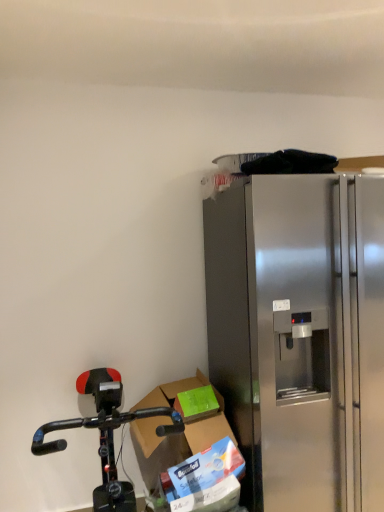
Question: Does black matte bicycle at lower left have a smaller size compared to stainless steel refrigerator at right?

Choices:
 (A) no
 (B) yes

Answer: (B)

Question: Considering the relative sizes of black matte bicycle at lower left and stainless steel refrigerator at right in the image provided, is black matte bicycle at lower left wider than stainless steel refrigerator at right?

Choices:
 (A) no
 (B) yes

Answer: (B)

Question: Considering the relative positions of black matte bicycle at lower left and stainless steel refrigerator at right in the image provided, is black matte bicycle at lower left to the left of stainless steel refrigerator at right from the viewer's perspective?

Choices:
 (A) yes
 (B) no

Answer: (A)

Question: Can stainless steel refrigerator at right be found inside black matte bicycle at lower left?

Choices:
 (A) no
 (B) yes

Answer: (A)

Question: From the image's perspective, is black matte bicycle at lower left located beneath stainless steel refrigerator at right?

Choices:
 (A) no
 (B) yes

Answer: (B)

Question: In terms of height, does black matte bicycle at lower left look taller or shorter compared to cardboard box at lower center?

Choices:
 (A) tall
 (B) short

Answer: (A)

Question: Considering the positions of black matte bicycle at lower left and cardboard box at lower center in the image, is black matte bicycle at lower left bigger or smaller than cardboard box at lower center?

Choices:
 (A) small
 (B) big

Answer: (B)

Question: Considering their positions, is black matte bicycle at lower left located in front of or behind cardboard box at lower center?

Choices:
 (A) front
 (B) behind

Answer: (A)

Question: Considering the positions of point (139, 411) and point (205, 381), is point (139, 411) closer or farther from the camera than point (205, 381)?

Choices:
 (A) farther
 (B) closer

Answer: (A)

Question: From the image's perspective, is cardboard box at lower center located above or below stainless steel refrigerator at right?

Choices:
 (A) above
 (B) below

Answer: (B)

Question: In terms of height, does cardboard box at lower center look taller or shorter compared to stainless steel refrigerator at right?

Choices:
 (A) short
 (B) tall

Answer: (A)

Question: From a real-world perspective, relative to stainless steel refrigerator at right, is cardboard box at lower center vertically above or below?

Choices:
 (A) below
 (B) above

Answer: (A)

Question: Is cardboard box at lower center to the left or to the right of stainless steel refrigerator at right in the image?

Choices:
 (A) right
 (B) left

Answer: (B)

Question: Do you think stainless steel refrigerator at right is within black matte bicycle at lower left, or outside of it?

Choices:
 (A) inside
 (B) outside

Answer: (B)

Question: In the image, is stainless steel refrigerator at right positioned in front of or behind black matte bicycle at lower left?

Choices:
 (A) front
 (B) behind

Answer: (B)